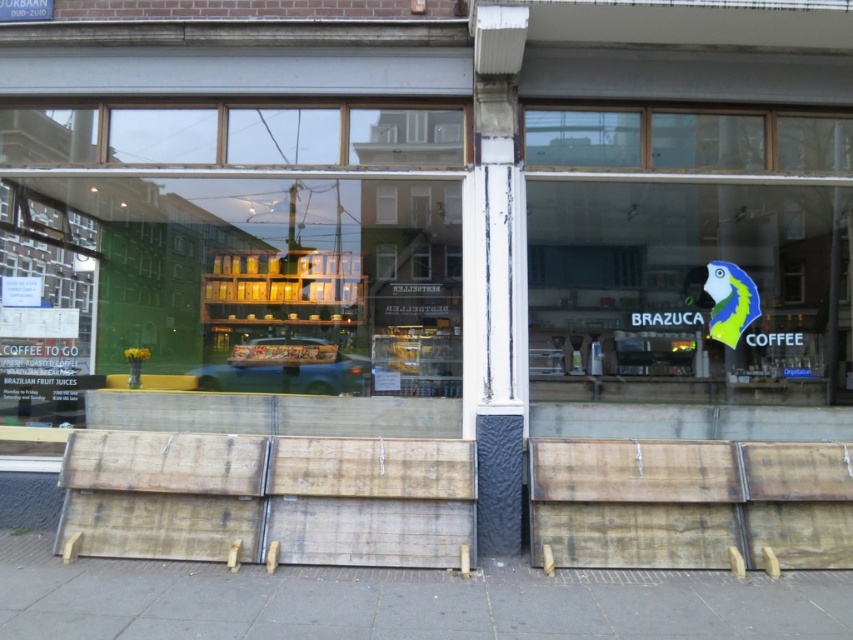
Question: Observing the image, what is the correct spatial positioning of metallic silver car at center in reference to green matte parrot at right?

Choices:
 (A) below
 (B) above

Answer: (A)

Question: Is transparent glass shop window at center further to the viewer compared to green matte parrot at right?

Choices:
 (A) no
 (B) yes

Answer: (B)

Question: Which point appears farthest from the camera in this image?

Choices:
 (A) (724, 316)
 (B) (318, 358)

Answer: (B)

Question: Which object is positioned farthest from the transparent glass window at upper center?

Choices:
 (A) green matte parrot at right
 (B) gray concrete pavement at lower center

Answer: (B)

Question: Which point appears farthest from the camera in this image?

Choices:
 (A) (751, 296)
 (B) (828, 573)
 (C) (381, 346)

Answer: (C)

Question: Observing the image, what is the correct spatial positioning of transparent glass shop window at center in reference to metallic silver car at center?

Choices:
 (A) above
 (B) below

Answer: (A)